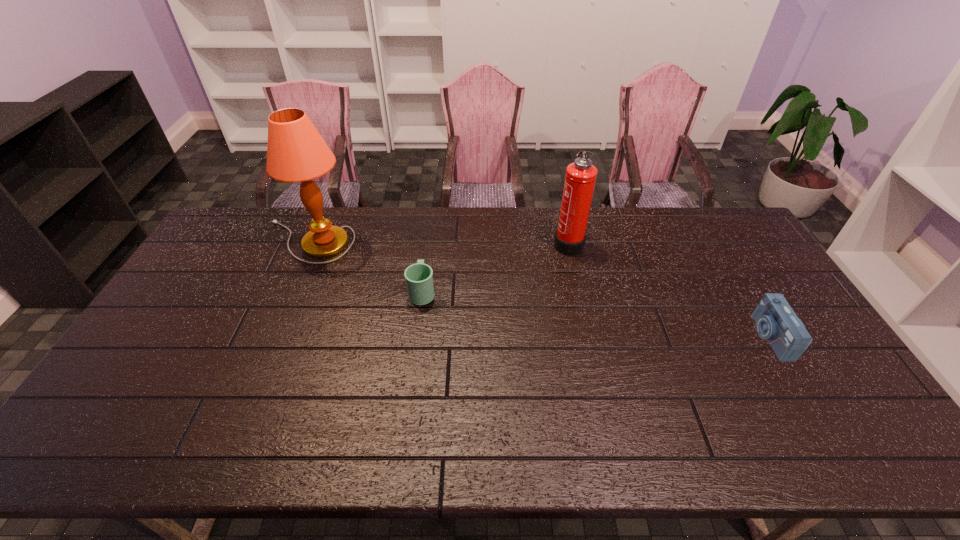
I want to click on free spot between the third object from left to right and the mug, so click(495, 267).

Find the location of a particular element. The width and height of the screenshot is (960, 540). empty space between the camera and the third farthest object is located at coordinates (596, 314).

I want to click on vacant region between the third object from left to right and the third object from right to left, so click(495, 267).

Locate an element on the screen. This screenshot has height=540, width=960. vacant space that's between the tallest object and the mug is located at coordinates (365, 267).

The image size is (960, 540). In order to click on free space between the lamp and the mug in this screenshot , I will do `click(365, 267)`.

I want to click on free point between the third object from right to left and the lamp, so click(365, 267).

This screenshot has height=540, width=960. I want to click on free spot between the second tallest object and the mug, so click(495, 267).

At what (x,y) coordinates should I click in order to perform the action: click on object that stands as the second closest to the third farthest object. Please return your answer as a coordinate pair (x, y). This screenshot has height=540, width=960. Looking at the image, I should click on (580, 179).

Image resolution: width=960 pixels, height=540 pixels. Find the location of `object that is the closest to the fire extinguisher`. object that is the closest to the fire extinguisher is located at coordinates (419, 280).